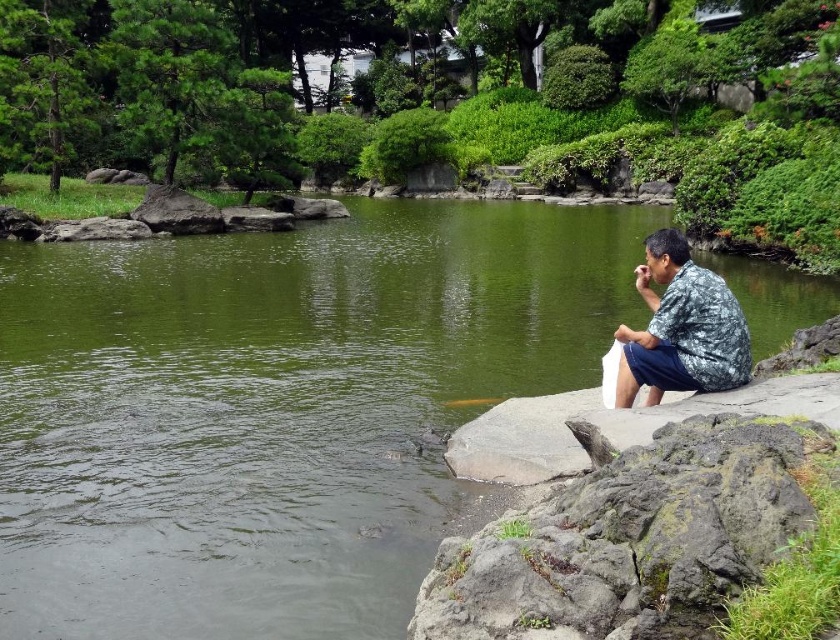
Is point (71, 464) closer to viewer compared to point (711, 272)?

Yes, point (71, 464) is in front of point (711, 272).

Does point (171, 586) come closer to viewer compared to point (657, 403)?

Yes, it is in front of point (657, 403).

Locate an element on the screen. This screenshot has height=640, width=840. green water at center is located at coordinates (277, 410).